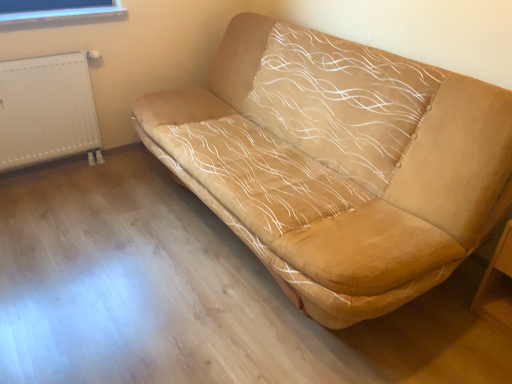
Image resolution: width=512 pixels, height=384 pixels. Identify the location of vacant space to the right of white plastic radiator at left. (119, 178).